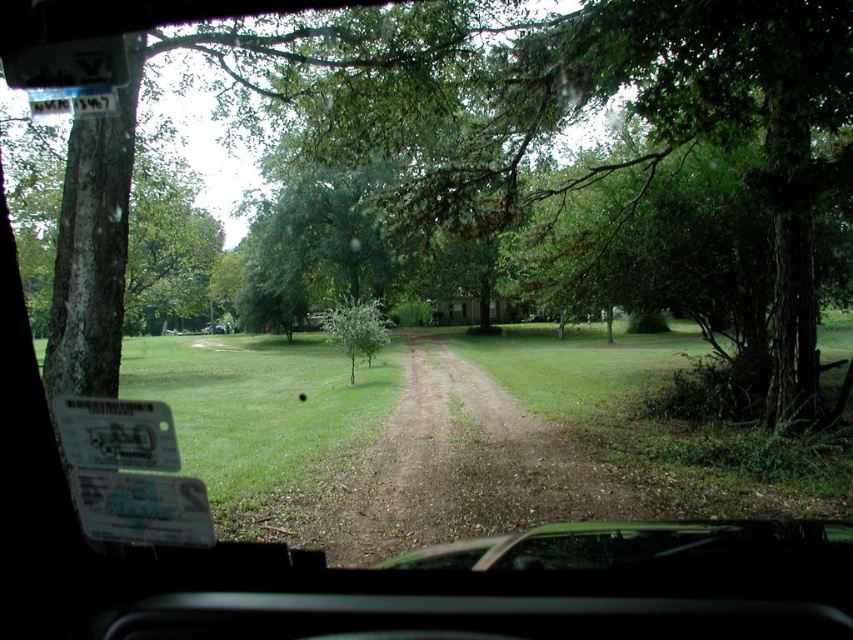
Is point (447, 509) farther from camera compared to point (351, 384)?

That is False.

Does point (401, 445) come behind point (380, 307)?

No.

Where is `brown gravel dirt track at center`? This screenshot has width=853, height=640. brown gravel dirt track at center is located at coordinates (462, 467).